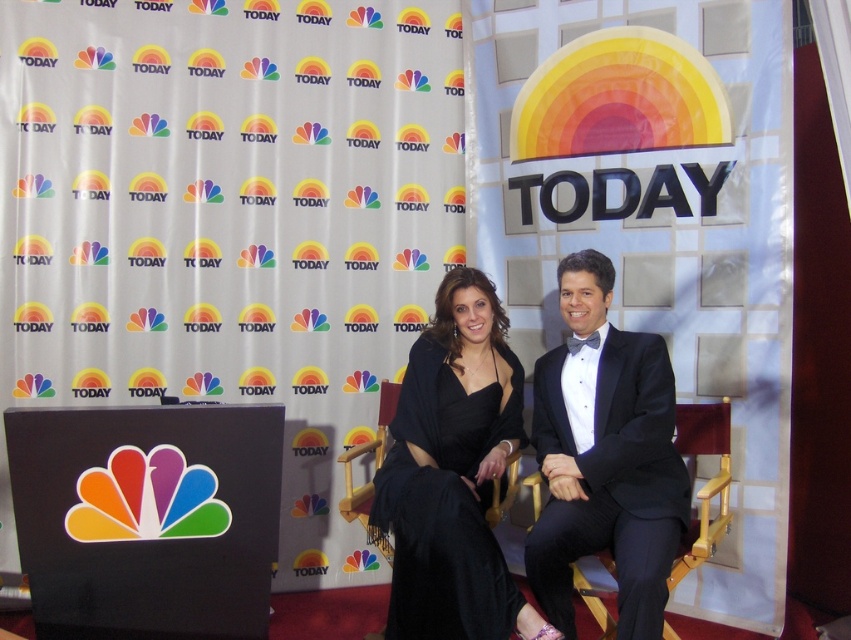
Can you confirm if black pinstripe suit at center is shorter than wooden chair at center?

No, black pinstripe suit at center is not shorter than wooden chair at center.

Between black pinstripe suit at center and wooden chair at center, which one appears on the left side from the viewer's perspective?

black pinstripe suit at center is more to the left.

Identify the location of black pinstripe suit at center. (604, 458).

At what (x,y) coordinates should I click in order to perform the action: click on black pinstripe suit at center. Please return your answer as a coordinate pair (x, y). This screenshot has height=640, width=851. Looking at the image, I should click on (604, 458).

Between point (604, 381) and point (420, 372), which one is positioned behind?

The point (420, 372) is behind.

This screenshot has width=851, height=640. I want to click on black pinstripe suit at center, so click(604, 458).

Who is taller, black satin dress at center or wooden chair at center?

black satin dress at center is taller.

Is point (423, 493) farther from camera compared to point (704, 452)?

No, it is not.

At what (x,y) coordinates should I click in order to perform the action: click on black satin dress at center. Please return your answer as a coordinate pair (x, y). Looking at the image, I should click on (453, 474).

The width and height of the screenshot is (851, 640). In order to click on black satin dress at center in this screenshot , I will do `click(453, 474)`.